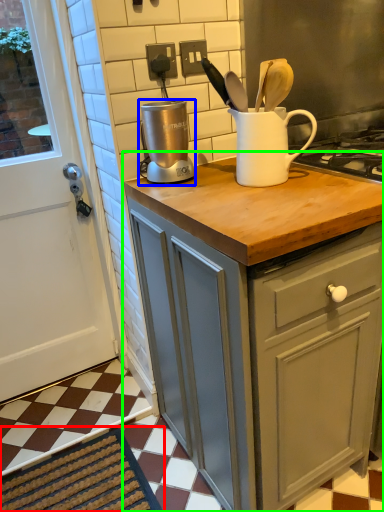
Question: Which object is positioned farthest from doormat (highlighted by a red box)? Select from kitchen appliance (highlighted by a blue box) and cabinetry (highlighted by a green box).

Choices:
 (A) kitchen appliance
 (B) cabinetry

Answer: (A)